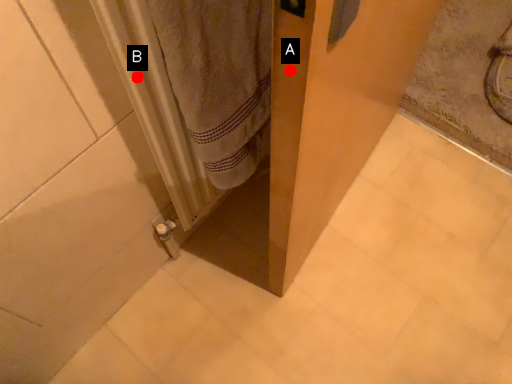
Question: Two points are circled on the image, labeled by A and B beside each circle. Which point is further to the camera?

Choices:
 (A) A is further
 (B) B is further

Answer: (B)